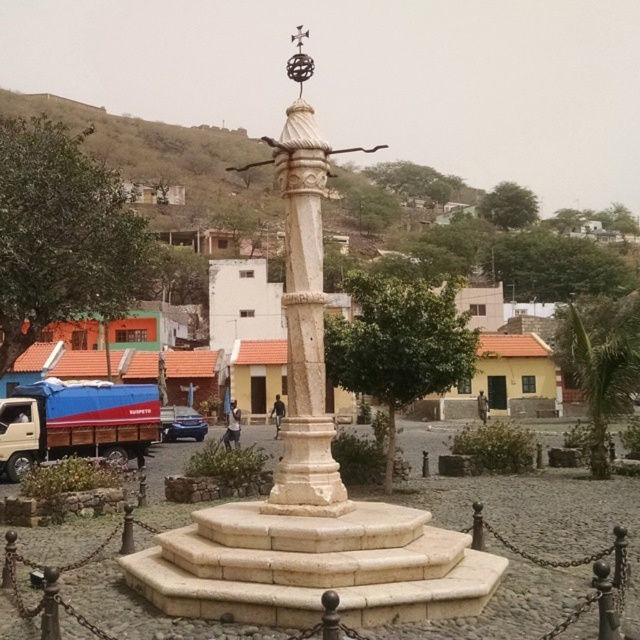
Between white marble column at center and satin blue sedan at lower left, which one is positioned higher?

white marble column at center is above.

Can you confirm if white marble column at center is shorter than satin blue sedan at lower left?

Incorrect, white marble column at center's height does not fall short of satin blue sedan at lower left's.

Locate an element on the screen. white marble column at center is located at coordinates (305, 308).

Where is `white marble column at center`? Image resolution: width=640 pixels, height=640 pixels. white marble column at center is located at coordinates (305, 308).